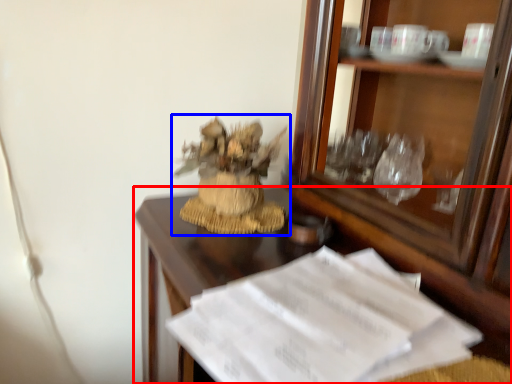
Question: Which of the following is the closest to the observer, desk (highlighted by a red box) or houseplant (highlighted by a blue box)?

Choices:
 (A) desk
 (B) houseplant

Answer: (A)